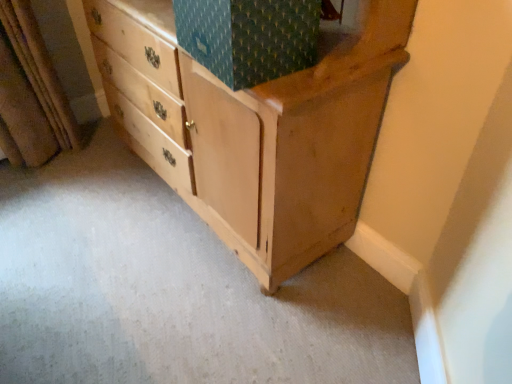
Where is `free spot to the left of light brown wood chest of drawers at lower left`? This screenshot has width=512, height=384. free spot to the left of light brown wood chest of drawers at lower left is located at coordinates (91, 216).